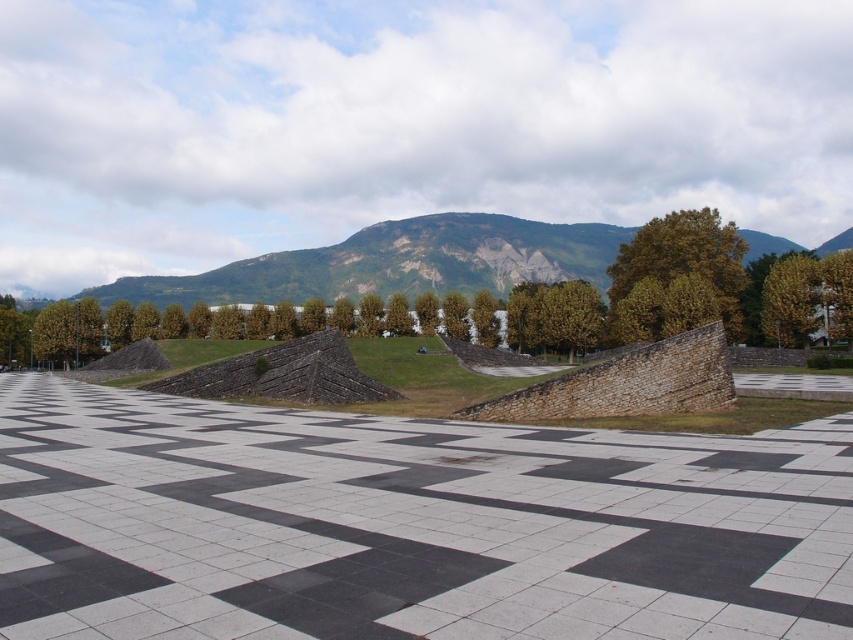
Question: Can you confirm if black and white stone plaza at center is wider than green leafy tree at right?

Choices:
 (A) no
 (B) yes

Answer: (B)

Question: Is black and white stone plaza at center below green leafy tree at right?

Choices:
 (A) yes
 (B) no

Answer: (A)

Question: Considering the real-world distances, which object is farthest from the green leafy tree at upper right?

Choices:
 (A) black and white stone plaza at center
 (B) green leafy tree at right

Answer: (A)

Question: Is black and white stone plaza at center thinner than green grassy hill at center?

Choices:
 (A) yes
 (B) no

Answer: (A)

Question: Which object appears closest to the camera in this image?

Choices:
 (A) black and white stone plaza at center
 (B) green leafy tree at right
 (C) green grassy hill at center

Answer: (A)

Question: Which object is the farthest from the black and white stone plaza at center?

Choices:
 (A) green grassy hill at center
 (B) green leafy tree at right

Answer: (A)